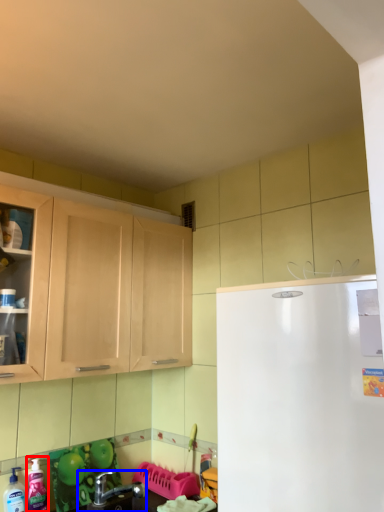
Question: Which of the following is the farthest to the observer, cleaning product (highlighted by a red box) or sink (highlighted by a blue box)?

Choices:
 (A) cleaning product
 (B) sink

Answer: (A)